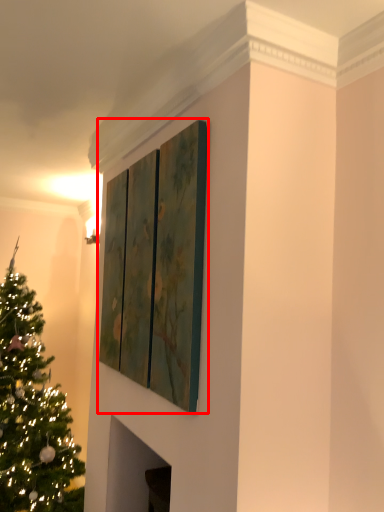
Question: Observing the image, what is the correct spatial positioning of window (annotated by the red box) in reference to christmas tree?

Choices:
 (A) right
 (B) left

Answer: (A)